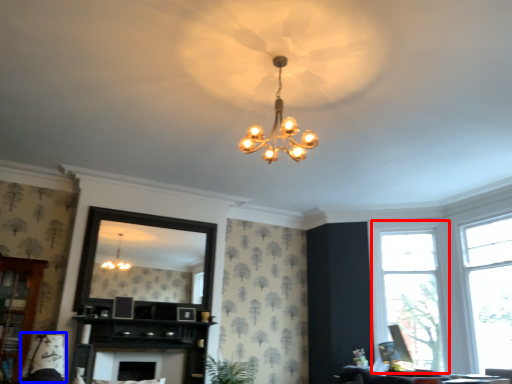
Question: Which object is further to the camera taking this photo, window (highlighted by a red box) or swivel chair (highlighted by a blue box)?

Choices:
 (A) window
 (B) swivel chair

Answer: (A)